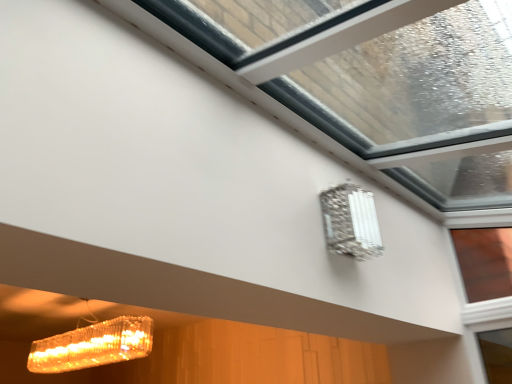
What is the approximate height of swarthy glass lamp at upper right?

swarthy glass lamp at upper right is 8.16 inches tall.

At what (x,y) coordinates should I click in order to perform the action: click on swarthy glass lamp at upper right. Please return your answer as a coordinate pair (x, y). Looking at the image, I should click on (351, 222).

Describe the element at coordinates (351, 222) in the screenshot. I see `swarthy glass lamp at upper right` at that location.

Locate an element on the screen. The width and height of the screenshot is (512, 384). swarthy glass lamp at upper right is located at coordinates (351, 222).